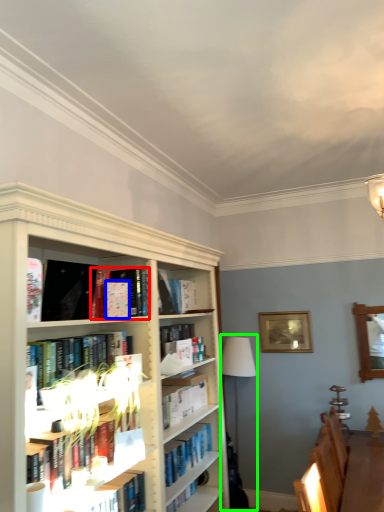
Question: Which is farther away from book (highlighted by a red box)? paperback book (highlighted by a blue box) or lamp (highlighted by a green box)?

Choices:
 (A) paperback book
 (B) lamp

Answer: (B)